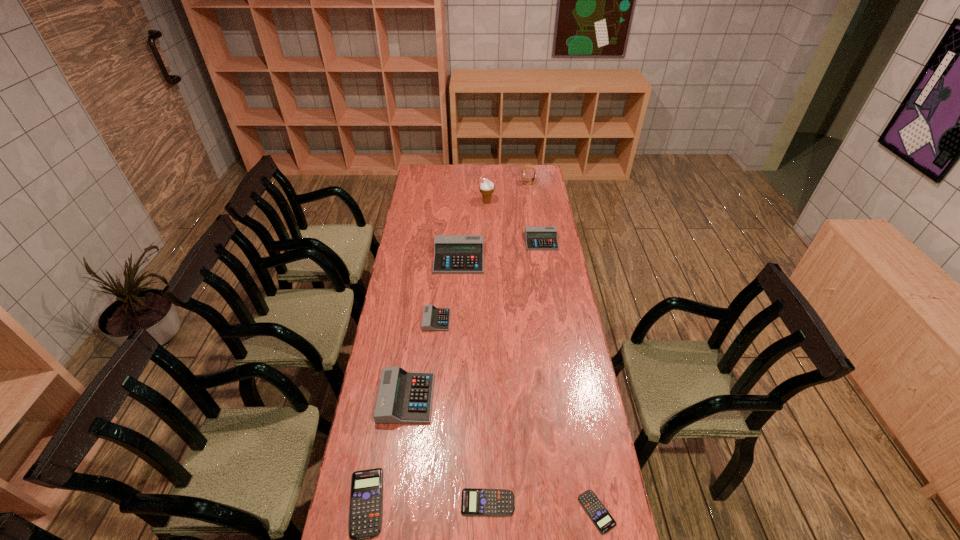
Where is `blue calculator that stands as the closest to the fifth shortest object`? This screenshot has width=960, height=540. blue calculator that stands as the closest to the fifth shortest object is located at coordinates (597, 512).

Select which blue calculator appears as the second closest to the sixth shortest calculator. Please provide its 2D coordinates. Your answer should be formatted as a tuple, i.e. [(x, y)], where the tuple contains the x and y coordinates of a point satisfying the conditions above.

[(475, 502)]

This screenshot has width=960, height=540. In order to click on vacant space that satisfies the following two spatial constraints: 1. on the back side of the fifth farthest object; 2. on the right side of the eighth nearest object in this screenshot , I will do `click(447, 202)`.

Where is `free space that satisfies the following two spatial constraints: 1. on the back side of the rightmost gray calculator; 2. on the left side of the fourth shortest object`? free space that satisfies the following two spatial constraints: 1. on the back side of the rightmost gray calculator; 2. on the left side of the fourth shortest object is located at coordinates (444, 241).

Find the location of a particular element. free location that satisfies the following two spatial constraints: 1. on the front side of the smallest blue calculator; 2. on the left side of the nearest gray calculator is located at coordinates pos(391,512).

Where is `vacant region that satisfies the following two spatial constraints: 1. on the face of the smallest blue calculator; 2. on the right side of the farthest object`? This screenshot has width=960, height=540. vacant region that satisfies the following two spatial constraints: 1. on the face of the smallest blue calculator; 2. on the right side of the farthest object is located at coordinates (579, 512).